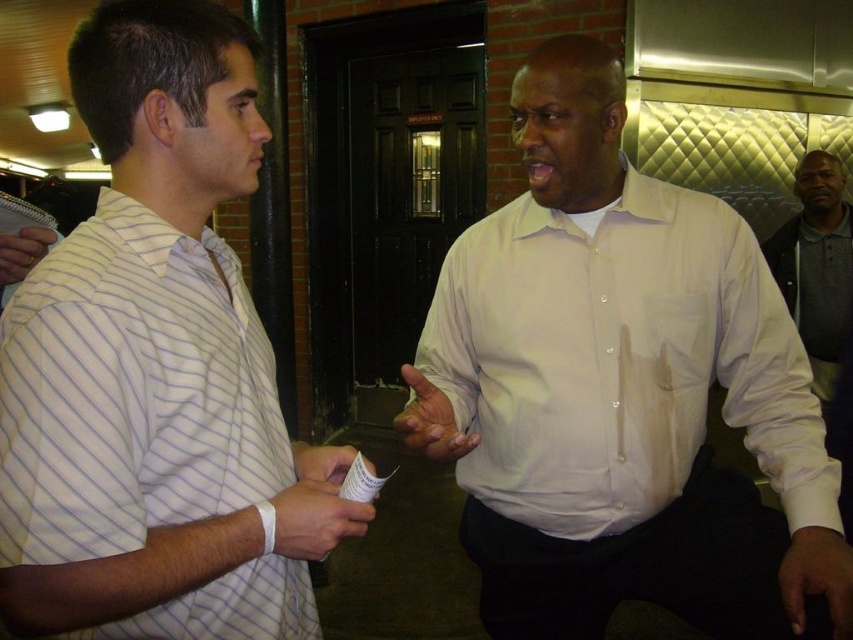
Question: Considering the relative positions of white smooth shirt at center and dark gray polo shirt at right in the image provided, where is white smooth shirt at center located with respect to dark gray polo shirt at right?

Choices:
 (A) left
 (B) right

Answer: (A)

Question: Which of these objects is positioned farthest from the dark gray polo shirt at right?

Choices:
 (A) white smooth shirt at center
 (B) white striped shirt at left

Answer: (B)

Question: Which object is positioned farthest from the dark gray polo shirt at right?

Choices:
 (A) white smooth shirt at center
 (B) white striped shirt at left

Answer: (B)

Question: Is white smooth shirt at center closer to the viewer compared to white striped shirt at left?

Choices:
 (A) no
 (B) yes

Answer: (A)

Question: Which of the following is the farthest from the observer?

Choices:
 (A) white smooth shirt at center
 (B) white striped shirt at left

Answer: (A)

Question: Is white smooth shirt at center below dark gray polo shirt at right?

Choices:
 (A) no
 (B) yes

Answer: (B)